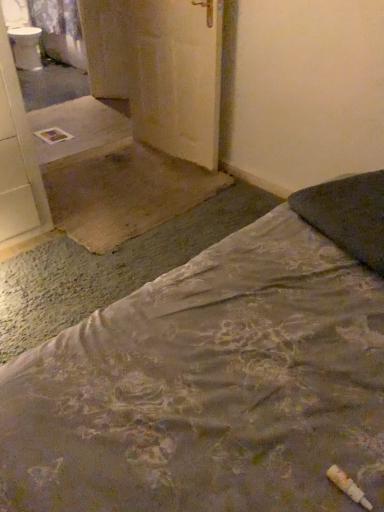
This screenshot has width=384, height=512. What do you see at coordinates (176, 76) in the screenshot? I see `matte yellow door at center` at bounding box center [176, 76].

This screenshot has height=512, width=384. Describe the element at coordinates (217, 378) in the screenshot. I see `floral fabric bed at lower right` at that location.

Locate an element on the screen. This screenshot has width=384, height=512. matte yellow door at center is located at coordinates (176, 76).

What are the coordinates of `bed above the white glossy sink at upper left (from a real-world perspective)` in the screenshot? It's located at (217, 378).

Considering the positions of objects floral fabric bed at lower right and white glossy sink at upper left in the image provided, who is behind, floral fabric bed at lower right or white glossy sink at upper left?

white glossy sink at upper left is behind.

Is floral fabric bed at lower right in contact with white glossy sink at upper left?

No, floral fabric bed at lower right is not in contact with white glossy sink at upper left.

From a real-world perspective, is floral fabric bed at lower right physically above white glossy sink at upper left?

Yes.

From a real-world perspective, which is physically below, white glossy sink at upper left or matte yellow door at center?

In real-world perspective, white glossy sink at upper left is lower.

Which is more to the left, white glossy sink at upper left or matte yellow door at center?

white glossy sink at upper left is more to the left.

Is point (10, 41) closer to camera compared to point (143, 95)?

No, (10, 41) is behind (143, 95).

Between white glossy sink at upper left and matte yellow door at center, which one has less height?

white glossy sink at upper left.

Does floral fabric bed at lower right have a lesser height compared to matte yellow door at center?

No.

From the image's perspective, between floral fabric bed at lower right and matte yellow door at center, who is located below?

floral fabric bed at lower right appears lower in the image.

Based on the photo, considering the relative sizes of floral fabric bed at lower right and matte yellow door at center in the image provided, is floral fabric bed at lower right smaller than matte yellow door at center?

No.

Considering the relative positions of floral fabric bed at lower right and matte yellow door at center in the image provided, is floral fabric bed at lower right behind matte yellow door at center?

No.

Is point (38, 51) behind point (243, 500)?

Yes, it is.

Which of these two, white glossy sink at upper left or floral fabric bed at lower right, stands shorter?

white glossy sink at upper left.

From the image's perspective, is white glossy sink at upper left positioned above or below floral fabric bed at lower right?

From the image's perspective, white glossy sink at upper left appears above floral fabric bed at lower right.

Locate an element on the screen. The image size is (384, 512). bed on the right side of white glossy sink at upper left is located at coordinates (217, 378).

Which object is thinner, dark gray fabric pillow at upper right or white glossy sink at upper left?

Thinner between the two is dark gray fabric pillow at upper right.

Is dark gray fabric pillow at upper right placed right next to white glossy sink at upper left?

There is a gap between dark gray fabric pillow at upper right and white glossy sink at upper left.

Is dark gray fabric pillow at upper right located outside white glossy sink at upper left?

Yes, dark gray fabric pillow at upper right is not within white glossy sink at upper left.

Can you confirm if dark gray fabric pillow at upper right is taller than floral fabric bed at lower right?

Incorrect, the height of dark gray fabric pillow at upper right is not larger of that of floral fabric bed at lower right.

From the image's perspective, which object appears higher, dark gray fabric pillow at upper right or floral fabric bed at lower right?

dark gray fabric pillow at upper right.

Is dark gray fabric pillow at upper right further to camera compared to floral fabric bed at lower right?

Yes, dark gray fabric pillow at upper right is further from the camera.

Is point (9, 425) in front of point (350, 225)?

That is True.

The width and height of the screenshot is (384, 512). Find the location of `pillow on the right of floral fabric bed at lower right`. pillow on the right of floral fabric bed at lower right is located at coordinates (348, 215).

From a real-world perspective, is floral fabric bed at lower right over dark gray fabric pillow at upper right?

No, from a real-world perspective, floral fabric bed at lower right is not above dark gray fabric pillow at upper right.

At what (x,y) coordinates should I click in order to perform the action: click on sink that is on the left side of floral fabric bed at lower right. Please return your answer as a coordinate pair (x, y). The height and width of the screenshot is (512, 384). Looking at the image, I should click on (22, 37).

I want to click on sink behind the matte yellow door at center, so click(22, 37).

Looking at the image, which one is located further to floral fabric bed at lower right, dark gray fabric pillow at upper right or matte yellow door at center?

matte yellow door at center.

Based on their spatial positions, is dark gray fabric pillow at upper right or floral fabric bed at lower right closer to white glossy sink at upper left?

dark gray fabric pillow at upper right is closer to white glossy sink at upper left.

Which object lies nearer to the anchor point white glossy sink at upper left, floral fabric bed at lower right or dark gray fabric pillow at upper right?

dark gray fabric pillow at upper right is positioned closer to the anchor white glossy sink at upper left.

When comparing their distances from dark gray fabric pillow at upper right, does white glossy sink at upper left or floral fabric bed at lower right seem closer?

Based on the image, floral fabric bed at lower right appears to be nearer to dark gray fabric pillow at upper right.

Which object lies further to the anchor point matte yellow door at center, floral fabric bed at lower right or white glossy sink at upper left?

Based on the image, white glossy sink at upper left appears to be further to matte yellow door at center.

Estimate the real-world distances between objects in this image. Which object is further from white glossy sink at upper left, floral fabric bed at lower right or matte yellow door at center?

Based on the image, floral fabric bed at lower right appears to be further to white glossy sink at upper left.

Estimate the real-world distances between objects in this image. Which object is closer to dark gray fabric pillow at upper right, floral fabric bed at lower right or matte yellow door at center?

Among the two, floral fabric bed at lower right is located nearer to dark gray fabric pillow at upper right.

Considering their positions, is white glossy sink at upper left positioned closer to floral fabric bed at lower right than dark gray fabric pillow at upper right?

Among the two, dark gray fabric pillow at upper right is located nearer to floral fabric bed at lower right.

You are a GUI agent. You are given a task and a screenshot of the screen. Output one action in this format:
    pyautogui.click(x=<x>, y=<y>)
    Task: Click on the door located between dark gray fabric pillow at upper right and white glossy sink at upper left in the depth direction
    The height and width of the screenshot is (512, 384).
    Given the screenshot: What is the action you would take?
    pyautogui.click(x=176, y=76)

Find the location of `pillow between floral fabric bed at lower right and matte yellow door at center from front to back`. pillow between floral fabric bed at lower right and matte yellow door at center from front to back is located at coordinates (348, 215).

Identify the location of door between floral fabric bed at lower right and white glossy sink at upper left along the z-axis. Image resolution: width=384 pixels, height=512 pixels. (176, 76).

Identify the location of pillow between floral fabric bed at lower right and white glossy sink at upper left along the z-axis. (348, 215).